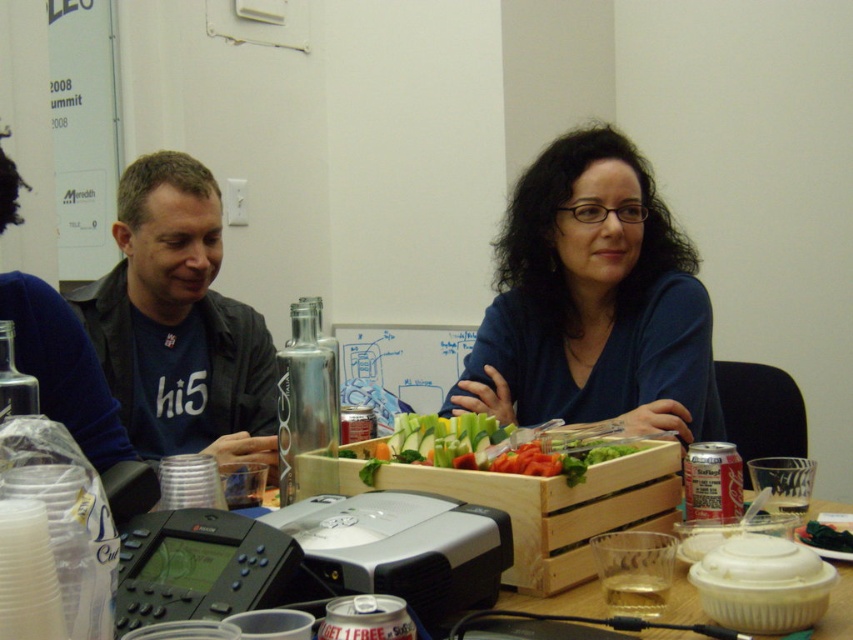
Does matte black jacket at left have a greater height compared to fresh green vegetables at center?

Yes.

Who is more distant from viewer, (271, 378) or (519, 460)?

The point (271, 378) is more distant.

Where is `matte black jacket at left`? This screenshot has width=853, height=640. matte black jacket at left is located at coordinates (178, 323).

Who is positioned more to the left, matte black jacket at left or wooden crate at center?

matte black jacket at left

Is point (209, 419) more distant than point (664, 481)?

Yes, point (209, 419) is farther from viewer.

This screenshot has width=853, height=640. Identify the location of matte black jacket at left. pos(178,323).

Is blue matte shirt at center positioned at the back of matte black jacket at left?

That is False.

At what (x,y) coordinates should I click in order to perform the action: click on blue matte shirt at center. Please return your answer as a coordinate pair (x, y). Image resolution: width=853 pixels, height=640 pixels. Looking at the image, I should click on (593, 301).